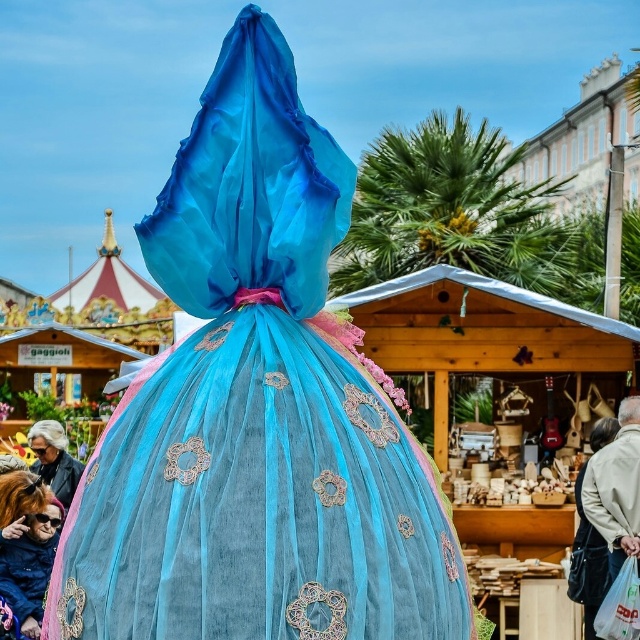
Question: Does translucent tulle dress at center have a larger size compared to light beige fabric bag at lower right?

Choices:
 (A) no
 (B) yes

Answer: (A)

Question: Which of these objects is positioned closest to the shiny blue fabric at center?

Choices:
 (A) matte black jacket at lower left
 (B) translucent tulle dress at center
 (C) light beige fabric bag at lower right

Answer: (C)

Question: Does translucent tulle dress at center have a larger size compared to light beige fabric bag at lower right?

Choices:
 (A) no
 (B) yes

Answer: (A)

Question: Can you confirm if shiny blue fabric at center is positioned to the left of light beige fabric bag at lower right?

Choices:
 (A) no
 (B) yes

Answer: (B)

Question: Among these points, which one is farthest from the camera?

Choices:
 (A) (592, 477)
 (B) (77, 627)
 (C) (45, 472)
 (D) (13, 566)

Answer: (C)

Question: Considering the real-world distances, which object is closest to the light beige fabric bag at lower right?

Choices:
 (A) shiny blue fabric at center
 (B) matte black jacket at lower left

Answer: (A)